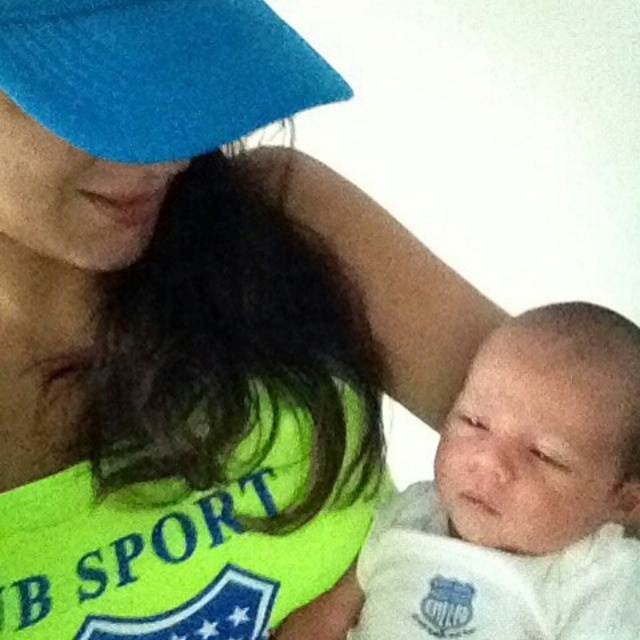
Is white soft cloth at center thinner than blue felt hat at upper left?

In fact, white soft cloth at center might be wider than blue felt hat at upper left.

Who is positioned more to the right, white soft cloth at center or blue felt hat at upper left?

white soft cloth at center

Which is in front, point (477, 452) or point (48, 10)?

Point (48, 10) is more forward.

This screenshot has height=640, width=640. In order to click on white soft cloth at center in this screenshot , I will do `click(522, 496)`.